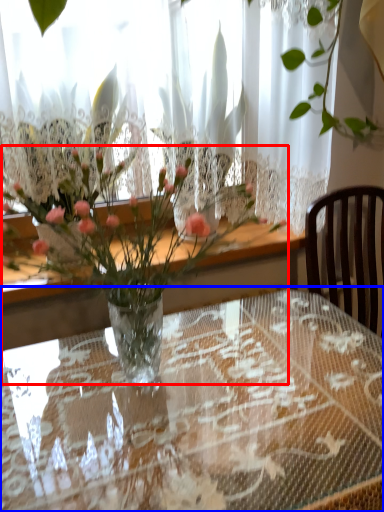
Question: Which of the following is the farthest to the observer, bouquet (highlighted by a red box) or table (highlighted by a blue box)?

Choices:
 (A) bouquet
 (B) table

Answer: (A)